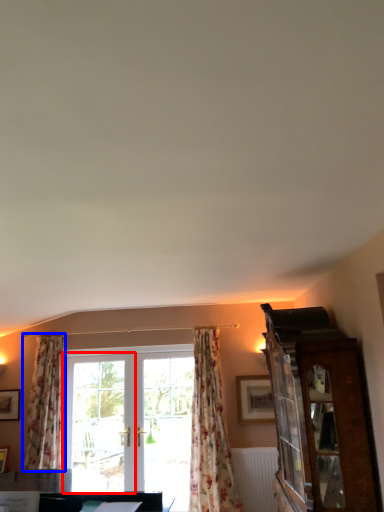
Question: Which object is closer to the camera taking this photo, screen door (highlighted by a red box) or curtain (highlighted by a blue box)?

Choices:
 (A) screen door
 (B) curtain

Answer: (B)